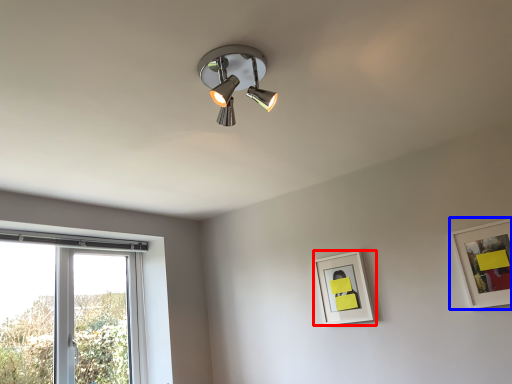
Question: Which object appears farthest to the camera in this image, picture frame (highlighted by a red box) or picture frame (highlighted by a blue box)?

Choices:
 (A) picture frame
 (B) picture frame

Answer: (A)